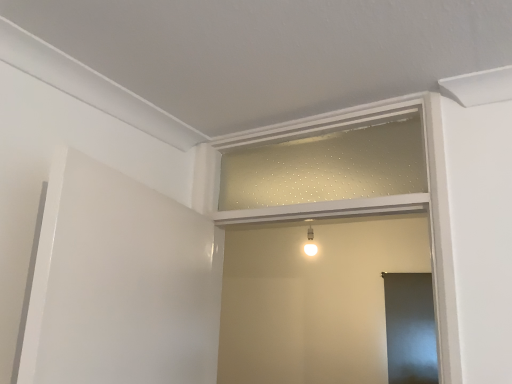
What do you see at coordinates (376, 197) in the screenshot? I see `white matte window frame at center, the first window frame ordered from the bottom` at bounding box center [376, 197].

Locate an element on the screen. white matte window frame at center, the first window frame ordered from the bottom is located at coordinates point(376,197).

The height and width of the screenshot is (384, 512). Identify the location of clear glass window frame at center, the 2th window frame from the bottom. (327, 163).

Image resolution: width=512 pixels, height=384 pixels. Describe the element at coordinates (327, 163) in the screenshot. I see `clear glass window frame at center, the 2th window frame from the bottom` at that location.

You are a GUI agent. You are given a task and a screenshot of the screen. Output one action in this format:
    pyautogui.click(x=<x>, y=<y>)
    Task: Click on the matte gray screen door at lower right
    This screenshot has width=512, height=384.
    Given the screenshot: What is the action you would take?
    pyautogui.click(x=410, y=328)

Considering the relative sizes of matte gray screen door at lower right and white matte window frame at center, which is the 2th window frame from top to bottom, in the image provided, is matte gray screen door at lower right wider than white matte window frame at center, which is the 2th window frame from top to bottom,?

In fact, matte gray screen door at lower right might be narrower than white matte window frame at center, which is the 2th window frame from top to bottom.

Is matte gray screen door at lower right with white matte window frame at center, which is the 2th window frame from top to bottom?

No, matte gray screen door at lower right is not in contact with white matte window frame at center, which is the 2th window frame from top to bottom.

In the image, is matte gray screen door at lower right positioned in front of or behind white matte window frame at center, the first window frame ordered from the bottom?

Visually, matte gray screen door at lower right is located behind white matte window frame at center, the first window frame ordered from the bottom.

Which is correct: white matte window frame at center, the first window frame ordered from the bottom, is inside clear glass window frame at center, the 2th window frame from the bottom, or outside of it?

white matte window frame at center, the first window frame ordered from the bottom, is outside clear glass window frame at center, the 2th window frame from the bottom.

From the image's perspective, who appears lower, white matte window frame at center, which is the 2th window frame from top to bottom, or clear glass window frame at center, marked as the 1th window frame in a top-to-bottom arrangement?

white matte window frame at center, which is the 2th window frame from top to bottom.

Is point (439, 227) positioned after point (274, 167)?

That is False.

Is white matte window frame at center, which is the 2th window frame from top to bottom, aimed at clear glass window frame at center, marked as the 1th window frame in a top-to-bottom arrangement?

Yes, white matte window frame at center, which is the 2th window frame from top to bottom, faces towards clear glass window frame at center, marked as the 1th window frame in a top-to-bottom arrangement.

Considering the sizes of white matte window frame at center, which is the 2th window frame from top to bottom, and matte gray screen door at lower right in the image, is white matte window frame at center, which is the 2th window frame from top to bottom, bigger or smaller than matte gray screen door at lower right?

white matte window frame at center, which is the 2th window frame from top to bottom, is bigger than matte gray screen door at lower right.

Are white matte window frame at center, which is the 2th window frame from top to bottom, and matte gray screen door at lower right far apart?

Yes, white matte window frame at center, which is the 2th window frame from top to bottom, is far from matte gray screen door at lower right.

In the scene shown: From a real-world perspective, who is located higher, white matte window frame at center, the first window frame ordered from the bottom, or matte gray screen door at lower right?

In real-world perspective, white matte window frame at center, the first window frame ordered from the bottom, is above.

Is matte gray screen door at lower right positioned far away from clear glass window frame at center, the 2th window frame from the bottom?

Yes, matte gray screen door at lower right and clear glass window frame at center, the 2th window frame from the bottom, are located far from each other.

Which object is thinner, matte gray screen door at lower right or clear glass window frame at center, the 2th window frame from the bottom?

With smaller width is clear glass window frame at center, the 2th window frame from the bottom.

Considering their positions, is matte gray screen door at lower right located in front of or behind clear glass window frame at center, marked as the 1th window frame in a top-to-bottom arrangement?

In the image, matte gray screen door at lower right appears behind clear glass window frame at center, marked as the 1th window frame in a top-to-bottom arrangement.

Is matte gray screen door at lower right shorter than clear glass window frame at center, the 2th window frame from the bottom?

In fact, matte gray screen door at lower right may be taller than clear glass window frame at center, the 2th window frame from the bottom.

From a real-world perspective, which is physically above, clear glass window frame at center, the 2th window frame from the bottom, or matte gray screen door at lower right?

From a 3D spatial view, clear glass window frame at center, the 2th window frame from the bottom, is above.

From a real-world perspective, which window frame is the 2nd one above the matte gray screen door at lower right? Please provide its 2D coordinates.

[(327, 163)]

Does clear glass window frame at center, the 2th window frame from the bottom, have a smaller size compared to matte gray screen door at lower right?

Indeed, clear glass window frame at center, the 2th window frame from the bottom, has a smaller size compared to matte gray screen door at lower right.

Is clear glass window frame at center, the 2th window frame from the bottom, oriented towards matte gray screen door at lower right?

No, clear glass window frame at center, the 2th window frame from the bottom, is not facing towards matte gray screen door at lower right.

From the image's perspective, is clear glass window frame at center, the 2th window frame from the bottom, over white matte window frame at center, which is the 2th window frame from top to bottom?

Yes, from the image's perspective, clear glass window frame at center, the 2th window frame from the bottom, is above white matte window frame at center, which is the 2th window frame from top to bottom.

The width and height of the screenshot is (512, 384). Find the location of `window frame that is on the right side of white matte window frame at center, the first window frame ordered from the bottom`. window frame that is on the right side of white matte window frame at center, the first window frame ordered from the bottom is located at coordinates (327, 163).

In terms of size, does clear glass window frame at center, the 2th window frame from the bottom, appear bigger or smaller than white matte window frame at center, which is the 2th window frame from top to bottom?

In the image, clear glass window frame at center, the 2th window frame from the bottom, appears to be smaller than white matte window frame at center, which is the 2th window frame from top to bottom.

In the image, is clear glass window frame at center, marked as the 1th window frame in a top-to-bottom arrangement, on the left side or the right side of white matte window frame at center, which is the 2th window frame from top to bottom?

clear glass window frame at center, marked as the 1th window frame in a top-to-bottom arrangement, is positioned on white matte window frame at center, which is the 2th window frame from top to bottom,'s right side.

Which window frame is the 2nd one when counting from the front of the matte gray screen door at lower right? Please provide its 2D coordinates.

[(376, 197)]

Find the location of `window frame on the right of white matte window frame at center, which is the 2th window frame from top to bottom`. window frame on the right of white matte window frame at center, which is the 2th window frame from top to bottom is located at coordinates (327, 163).

From the image, which object appears to be farther from clear glass window frame at center, marked as the 1th window frame in a top-to-bottom arrangement, white matte window frame at center, the first window frame ordered from the bottom, or matte gray screen door at lower right?

matte gray screen door at lower right is further to clear glass window frame at center, marked as the 1th window frame in a top-to-bottom arrangement.

Which object lies nearer to the anchor point white matte window frame at center, which is the 2th window frame from top to bottom, clear glass window frame at center, the 2th window frame from the bottom, or matte gray screen door at lower right?

clear glass window frame at center, the 2th window frame from the bottom, is closer to white matte window frame at center, which is the 2th window frame from top to bottom.

Estimate the real-world distances between objects in this image. Which object is closer to matte gray screen door at lower right, clear glass window frame at center, the 2th window frame from the bottom, or white matte window frame at center, which is the 2th window frame from top to bottom?

clear glass window frame at center, the 2th window frame from the bottom, is closer to matte gray screen door at lower right.

Estimate the real-world distances between objects in this image. Which object is further from clear glass window frame at center, marked as the 1th window frame in a top-to-bottom arrangement, matte gray screen door at lower right or white matte window frame at center, the first window frame ordered from the bottom?

matte gray screen door at lower right.

Considering their positions, is white matte window frame at center, which is the 2th window frame from top to bottom, positioned closer to matte gray screen door at lower right than clear glass window frame at center, marked as the 1th window frame in a top-to-bottom arrangement?

clear glass window frame at center, marked as the 1th window frame in a top-to-bottom arrangement, lies closer to matte gray screen door at lower right than the other object.

Considering their positions, is matte gray screen door at lower right positioned closer to white matte window frame at center, which is the 2th window frame from top to bottom, than clear glass window frame at center, marked as the 1th window frame in a top-to-bottom arrangement?

clear glass window frame at center, marked as the 1th window frame in a top-to-bottom arrangement.

Where is `window frame located between white matte window frame at center, the first window frame ordered from the bottom, and matte gray screen door at lower right in the depth direction`? This screenshot has width=512, height=384. window frame located between white matte window frame at center, the first window frame ordered from the bottom, and matte gray screen door at lower right in the depth direction is located at coordinates (327, 163).